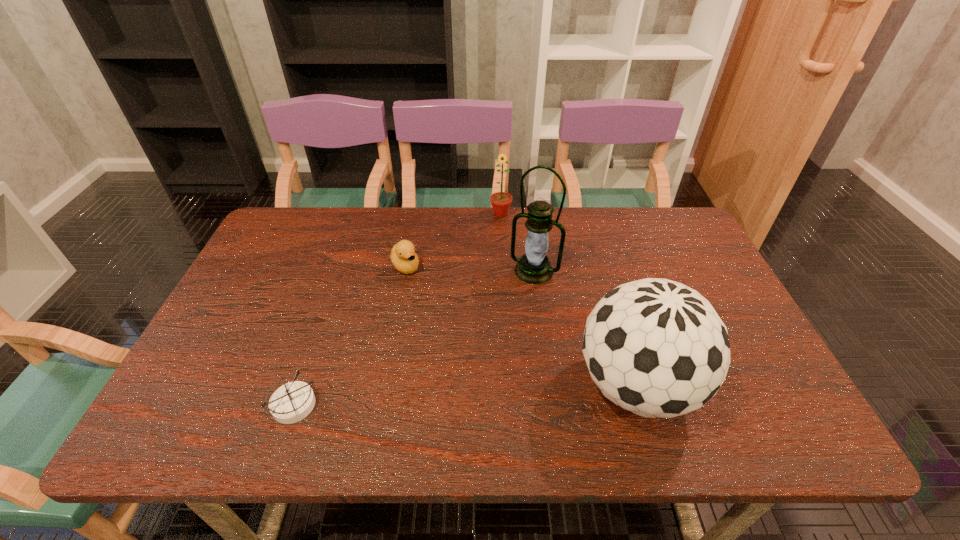
Where is `free spot on the desktop that is between the shortest object and the soccer ball and is positioned on the face of the sunflower`? Image resolution: width=960 pixels, height=540 pixels. free spot on the desktop that is between the shortest object and the soccer ball and is positioned on the face of the sunflower is located at coordinates (432, 398).

Find the location of `free space on the desktop that is between the shortest object and the fourth shortest object and is positioned facing forward on the duckling`. free space on the desktop that is between the shortest object and the fourth shortest object and is positioned facing forward on the duckling is located at coordinates (504, 394).

Locate an element on the screen. free space on the desktop that is between the compass and the second tallest object and is positioned on the side where the tallest object emits light is located at coordinates (464, 396).